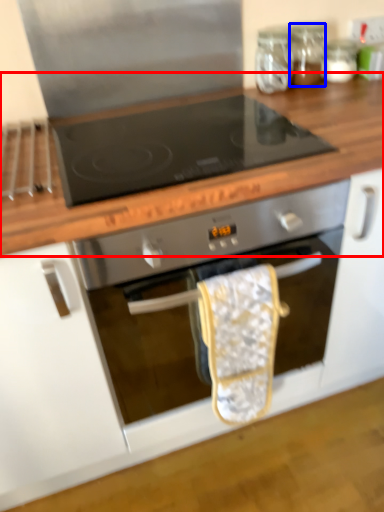
Question: Which object appears farthest to the camera in this image, countertop (highlighted by a red box) or glass jar (highlighted by a blue box)?

Choices:
 (A) countertop
 (B) glass jar

Answer: (B)